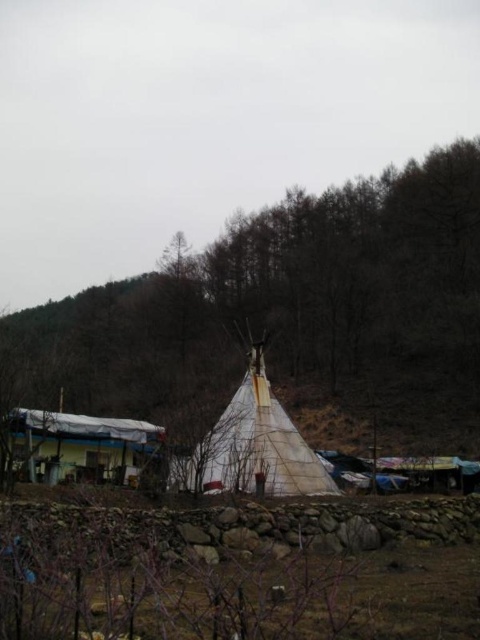
Is point (429, 332) positioned in front of point (151, 451)?

No, it is behind (151, 451).

Can you confirm if white fabric teepee at center is smaller than white canvas tent at lower left?

Actually, white fabric teepee at center might be larger than white canvas tent at lower left.

The image size is (480, 640). I want to click on white fabric teepee at center, so click(285, 310).

Between white canvas tent at center and white canvas tent at lower left, which one is positioned higher?

white canvas tent at center

Which is in front, point (284, 468) or point (115, 452)?

Point (284, 468) is in front.

This screenshot has width=480, height=640. Find the location of `white canvas tent at center`. white canvas tent at center is located at coordinates (252, 445).

Who is higher up, white fabric teepee at center or white canvas tent at center?

white fabric teepee at center is higher up.

The width and height of the screenshot is (480, 640). I want to click on white fabric teepee at center, so click(x=285, y=310).